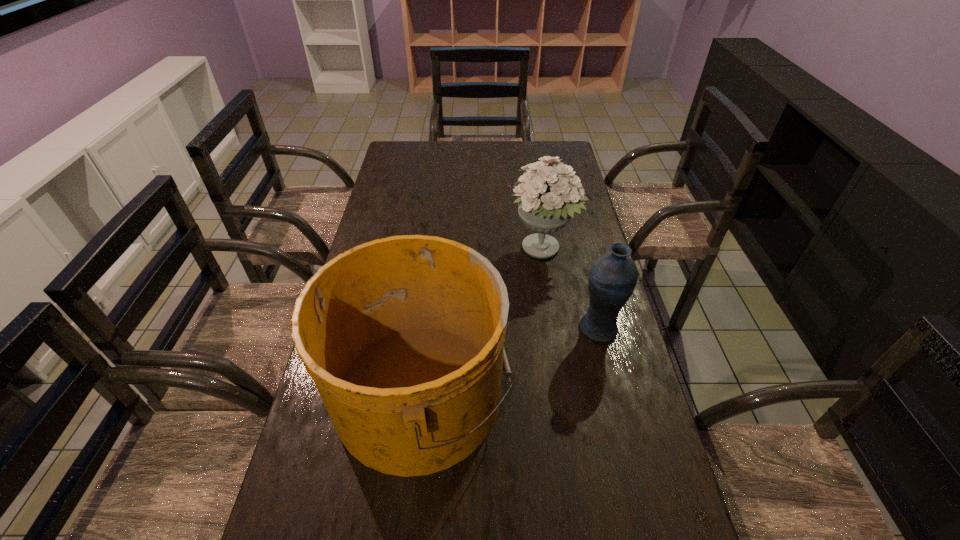
Where is `bouquet`? The image size is (960, 540). bouquet is located at coordinates (548, 195).

At what (x,y) coordinates should I click in order to perform the action: click on bucket. Please return your answer as a coordinate pair (x, y). Looking at the image, I should click on (403, 336).

This screenshot has width=960, height=540. In order to click on vase in this screenshot , I will do `click(613, 276)`.

Image resolution: width=960 pixels, height=540 pixels. What are the coordinates of `vacant space located on the back of the bouquet` in the screenshot? It's located at (x=533, y=186).

You are a GUI agent. You are given a task and a screenshot of the screen. Output one action in this format:
    pyautogui.click(x=<x>, y=<y>)
    Task: Click on the free space located 0.250m on the right of the bucket
    
    Given the screenshot: What is the action you would take?
    tap(612, 393)

Locate an element on the screen. The image size is (960, 540). vacant region located 0.250m on the front of the vase is located at coordinates (625, 433).

Find the location of a particular element. The height and width of the screenshot is (540, 960). object that is at the left edge is located at coordinates (403, 336).

I want to click on bouquet that is at the right edge, so click(548, 195).

This screenshot has width=960, height=540. I want to click on vase that is at the right edge, so click(x=613, y=276).

In order to click on vacant space at the far edge of the desktop in this screenshot , I will do `click(484, 147)`.